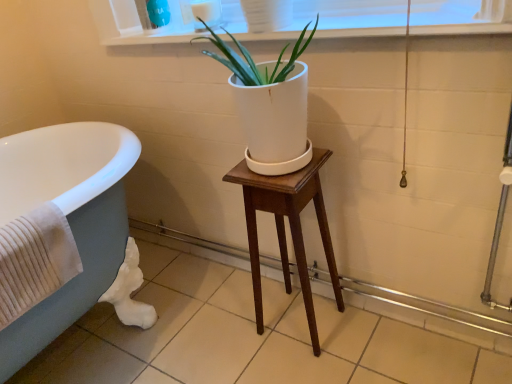
This screenshot has height=384, width=512. Describe the element at coordinates (284, 228) in the screenshot. I see `mahogany wood stool at center` at that location.

Describe the element at coordinates (67, 218) in the screenshot. I see `matte gray tub at left` at that location.

Identify the location of white matte pot at center. This screenshot has width=512, height=384. (270, 105).

Is matte gray tub at left at the right side of white glossy window sill at upper center?

No.

Does point (25, 352) lie in front of point (364, 35)?

No, it is behind (364, 35).

Is matte gray tub at left completely or partially outside of white glossy window sill at upper center?

Yes, matte gray tub at left is outside of white glossy window sill at upper center.

Find the location of a particular element. houseplant that is on the right side of matte gray tub at left is located at coordinates (270, 105).

Between point (261, 72) and point (109, 250), which one is positioned in front?

The point (261, 72) is closer.

From a real-world perspective, is white matte pot at center above or below matte gray tub at left?

In terms of real-world spatial position, white matte pot at center is above matte gray tub at left.

Who is smaller, white matte pot at center or matte gray tub at left?

With smaller size is white matte pot at center.

Considering the points (176, 36) and (298, 178), which point is behind, point (176, 36) or point (298, 178)?

The point (176, 36) is farther.

Could you tell me if white glossy window sill at upper center is facing mahogany wood stool at center?

No, white glossy window sill at upper center is not aimed at mahogany wood stool at center.

Choose the correct answer: Is white glossy window sill at upper center inside mahogany wood stool at center or outside it?

white glossy window sill at upper center lies outside mahogany wood stool at center.

Is the position of matte gray tub at left more distant than that of white matte pot at center?

Yes, matte gray tub at left is further from the viewer.

From the image's perspective, between matte gray tub at left and white matte pot at center, who is located below?

matte gray tub at left.

Is point (79, 304) more distant than point (282, 137)?

Yes, point (79, 304) is behind point (282, 137).

From a real-world perspective, is matte gray tub at left physically above white matte pot at center?

No, from a real-world perspective, matte gray tub at left is not on top of white matte pot at center.

Considering the sizes of objects mahogany wood stool at center and matte gray tub at left in the image provided, who is shorter, mahogany wood stool at center or matte gray tub at left?

mahogany wood stool at center.

How distant is mahogany wood stool at center from matte gray tub at left?

mahogany wood stool at center is 22.64 inches away from matte gray tub at left.

Which object is positioned more to the left, mahogany wood stool at center or matte gray tub at left?

matte gray tub at left is more to the left.

Do you think mahogany wood stool at center is within matte gray tub at left, or outside of it?

mahogany wood stool at center exists outside the volume of matte gray tub at left.

Is white glossy window sill at upper center with white matte pot at center?

white glossy window sill at upper center and white matte pot at center are not in contact.

Is white glossy window sill at upper center bigger than white matte pot at center?

Actually, white glossy window sill at upper center might be smaller than white matte pot at center.

Does white glossy window sill at upper center lie behind white matte pot at center?

Yes, white glossy window sill at upper center is further from the camera.

From the image's perspective, which is below, white glossy window sill at upper center or white matte pot at center?

white matte pot at center, from the image's perspective.

Is point (258, 331) behind point (508, 31)?

Yes.

Which is behind, mahogany wood stool at center or white glossy window sill at upper center?

mahogany wood stool at center is more distant.

Between mahogany wood stool at center and white glossy window sill at upper center, which one has less height?

white glossy window sill at upper center.

Who is bigger, mahogany wood stool at center or white glossy window sill at upper center?

mahogany wood stool at center is bigger.

Image resolution: width=512 pixels, height=384 pixels. I want to click on bathtub below the white glossy window sill at upper center (from the image's perspective), so click(67, 218).

Where is `houseplant that appears in front of the matte gray tub at left`? This screenshot has height=384, width=512. houseplant that appears in front of the matte gray tub at left is located at coordinates (270, 105).

Considering their positions, is white glossy window sill at upper center positioned closer to white matte pot at center than mahogany wood stool at center?

mahogany wood stool at center lies closer to white matte pot at center than the other object.

From the picture: Based on their spatial positions, is mahogany wood stool at center or matte gray tub at left further from white matte pot at center?

matte gray tub at left.

Consider the image. Looking at the image, which one is located further to matte gray tub at left, mahogany wood stool at center or white matte pot at center?

mahogany wood stool at center.

Estimate the real-world distances between objects in this image. Which object is further from white glossy window sill at upper center, white matte pot at center or mahogany wood stool at center?

mahogany wood stool at center lies further to white glossy window sill at upper center than the other object.

Looking at the image, which one is located further to mahogany wood stool at center, white glossy window sill at upper center or white matte pot at center?

Based on the image, white glossy window sill at upper center appears to be further to mahogany wood stool at center.

When comparing their distances from mahogany wood stool at center, does white glossy window sill at upper center or matte gray tub at left seem closer?

white glossy window sill at upper center is closer to mahogany wood stool at center.

Which object lies nearer to the anchor point white matte pot at center, matte gray tub at left or white glossy window sill at upper center?

white glossy window sill at upper center lies closer to white matte pot at center than the other object.

From the image, which object appears to be nearer to mahogany wood stool at center, white matte pot at center or white glossy window sill at upper center?

white matte pot at center is positioned closer to the anchor mahogany wood stool at center.

Find the location of a particular element. Image resolution: width=512 pixels, height=384 pixels. houseplant between matte gray tub at left and mahogany wood stool at center in the horizontal direction is located at coordinates (270, 105).

Where is `houseplant situated between matte gray tub at left and white glossy window sill at upper center from left to right`? This screenshot has width=512, height=384. houseplant situated between matte gray tub at left and white glossy window sill at upper center from left to right is located at coordinates (270, 105).

At what (x,y) coordinates should I click in order to perform the action: click on houseplant between white glossy window sill at upper center and mahogany wood stool at center in the up-down direction. Please return your answer as a coordinate pair (x, y). Looking at the image, I should click on (270, 105).

This screenshot has height=384, width=512. I want to click on window sill between matte gray tub at left and mahogany wood stool at center in the horizontal direction, so click(x=417, y=31).